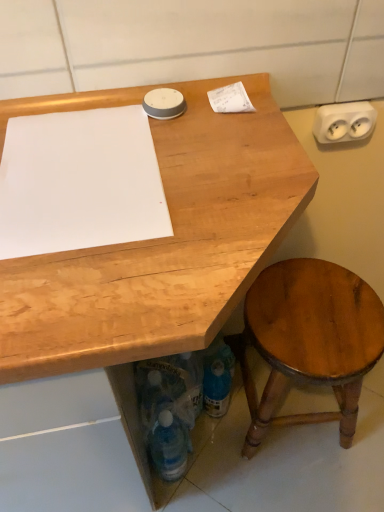
Locate an element on the screen. The height and width of the screenshot is (512, 384). vacant region above shiny brown wood stool at lower right (from a real-world perspective) is located at coordinates (314, 316).